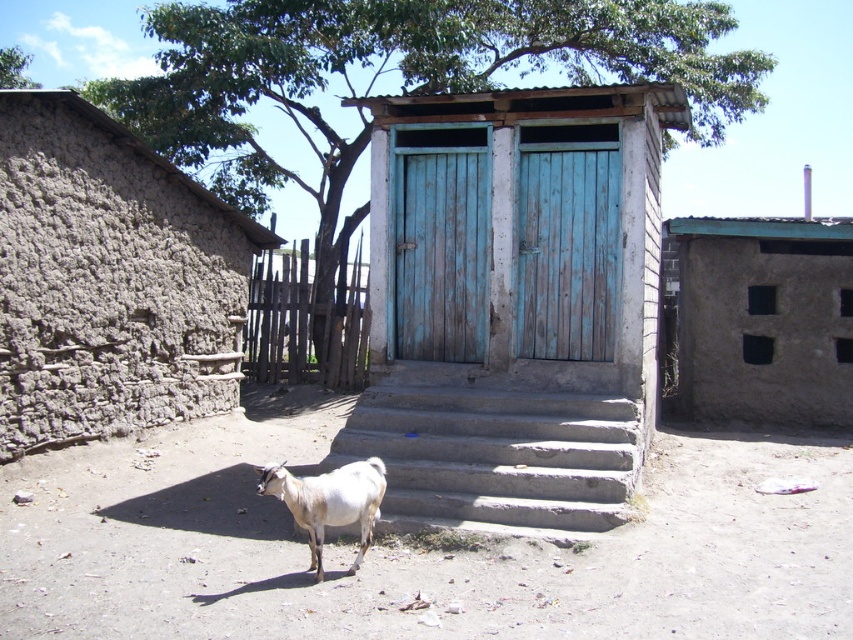
You are a farmer who wants to build a fence around the clay mud wall at left and the white woolen goat at lower center. Which object requires a larger area for the fence?

The clay mud wall at left requires a larger area for the fence because it is bigger than the white woolen goat at lower center.

You are a visitor approaching the two blue doors of the structure. You notice the clay mud wall at left and the brown mud hut at upper right. Which of these two objects is closer to you as you approach the doors?

The clay mud wall at left is closer to you because it is in front of the brown mud hut at upper right.

You are standing in front of the communal toilet structure and want to walk towards the clay mud wall at left and the white woolen goat at lower center. Which one will you reach first?

You will reach the clay mud wall at left first because it is closer to you than the white woolen goat at lower center, which is further away.